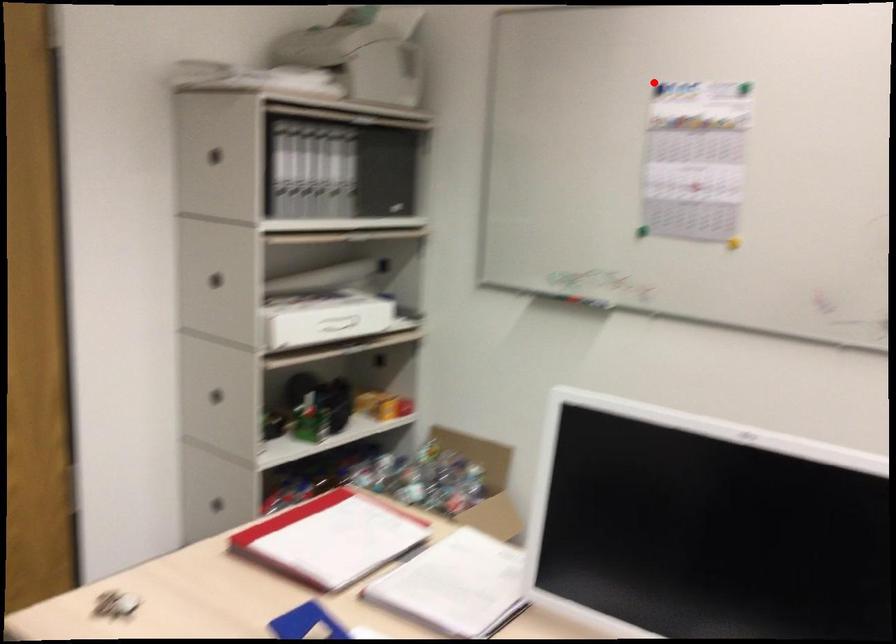
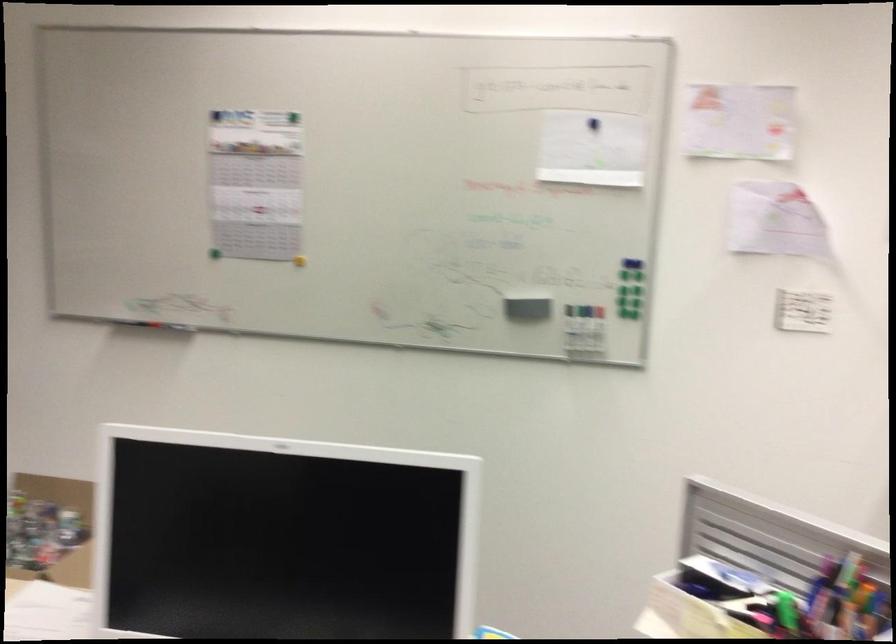
Question: I am providing you with two images of the same scene from different viewpoints. A red point is marked on the first image. Can you still see the location of the red point in image 2?

Choices:
 (A) Yes
 (B) No

Answer: (A)